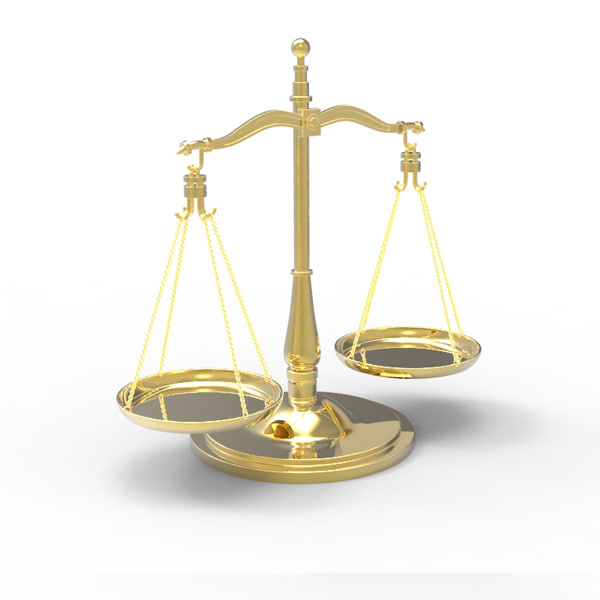
You are a GUI agent. You are given a task and a screenshot of the screen. Output one action in this format:
    pyautogui.click(x=<x>, y=<y>)
    Task: Click on the plate
    This screenshot has height=600, width=600.
    Given the screenshot: What is the action you would take?
    pyautogui.click(x=429, y=356)